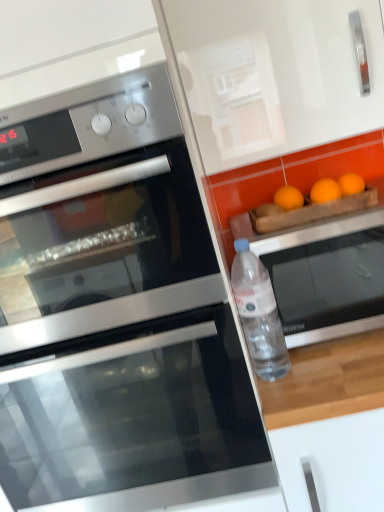
I want to click on transparent plastic bottle at right, so click(259, 314).

Identify the location of stainless steel oven at left, which appears as the 3th oven when viewed from the right. (107, 254).

From a real-world perspective, is stainless steel oven at right, the 3th oven positioned from the left, physically above transparent plastic bottle at right?

No, from a real-world perspective, stainless steel oven at right, the 3th oven positioned from the left, is not on top of transparent plastic bottle at right.

How different are the orientations of stainless steel oven at right, which is the first oven in right-to-left order, and transparent plastic bottle at right in degrees?

stainless steel oven at right, which is the first oven in right-to-left order, and transparent plastic bottle at right are facing 0.00254 degrees away from each other.

Which point is more forward, (370,312) or (274,297)?

The point (274,297) is closer to the camera.

Is stainless steel oven at right, which is the first oven in right-to-left order, spatially inside stainless steel oven at left, which ranks as the 1th oven in left-to-right order, or outside of it?

stainless steel oven at right, which is the first oven in right-to-left order, exists outside the volume of stainless steel oven at left, which ranks as the 1th oven in left-to-right order.

From a real-world perspective, is stainless steel oven at right, which is the first oven in right-to-left order, positioned under stainless steel oven at left, which ranks as the 1th oven in left-to-right order, based on gravity?

Indeed, from a real-world perspective, stainless steel oven at right, which is the first oven in right-to-left order, is positioned beneath stainless steel oven at left, which ranks as the 1th oven in left-to-right order.

Locate an element on the screen. The image size is (384, 512). oven located above the stainless steel oven at right, which is the first oven in right-to-left order (from a real-world perspective) is located at coordinates [107, 254].

Is stainless steel oven at right, the 3th oven positioned from the left, facing away from stainless steel oven at left, which ranks as the 1th oven in left-to-right order?

That's not correct — stainless steel oven at right, the 3th oven positioned from the left, is not looking away from stainless steel oven at left, which ranks as the 1th oven in left-to-right order.

Considering the sizes of objects stainless steel oven at right, which is the first oven in right-to-left order, and stainless steel oven at lower left, which ranks as the second oven in left-to-right order, in the image provided, who is thinner, stainless steel oven at right, which is the first oven in right-to-left order, or stainless steel oven at lower left, which ranks as the second oven in left-to-right order,?

stainless steel oven at right, which is the first oven in right-to-left order.

Is stainless steel oven at right, which is the first oven in right-to-left order, at the right side of stainless steel oven at lower left, which ranks as the second oven in left-to-right order?

Yes.

From the image's perspective, which oven is the 1st one above the stainless steel oven at lower left, which is counted as the second oven, starting from the right? Please provide its 2D coordinates.

[(327, 276)]

From a real-world perspective, is stainless steel oven at right, the 3th oven positioned from the left, located higher than stainless steel oven at lower left, which is counted as the second oven, starting from the right?

Indeed, from a real-world perspective, stainless steel oven at right, the 3th oven positioned from the left, stands above stainless steel oven at lower left, which is counted as the second oven, starting from the right.

From a real-world perspective, who is located higher, transparent plastic bottle at right or stainless steel oven at right, the 3th oven positioned from the left?

transparent plastic bottle at right, from a real-world perspective.

Considering the sizes of transparent plastic bottle at right and stainless steel oven at right, the 3th oven positioned from the left, in the image, is transparent plastic bottle at right taller or shorter than stainless steel oven at right, the 3th oven positioned from the left,?

Considering their sizes, transparent plastic bottle at right has more height than stainless steel oven at right, the 3th oven positioned from the left.

Is transparent plastic bottle at right to the left or to the right of stainless steel oven at right, the 3th oven positioned from the left, in the image?

Based on their positions, transparent plastic bottle at right is located to the left of stainless steel oven at right, the 3th oven positioned from the left.

Based on the photo, are transparent plastic bottle at right and stainless steel oven at right, which is the first oven in right-to-left order, beside each other?

They are not placed beside each other.

Is stainless steel oven at left, which appears as the 3th oven when viewed from the right, at the back of transparent plastic bottle at right?

No.

Which of these two, transparent plastic bottle at right or stainless steel oven at left, which ranks as the 1th oven in left-to-right order, is bigger?

stainless steel oven at left, which ranks as the 1th oven in left-to-right order.

From the image's perspective, is transparent plastic bottle at right positioned above or below stainless steel oven at left, which ranks as the 1th oven in left-to-right order?

Based on their image positions, transparent plastic bottle at right is located beneath stainless steel oven at left, which ranks as the 1th oven in left-to-right order.

Considering the points (285, 369) and (40, 296), which point is behind, point (285, 369) or point (40, 296)?

Point (285, 369)

Which object is wider, stainless steel oven at left, which appears as the 3th oven when viewed from the right, or transparent plastic bottle at right?

stainless steel oven at left, which appears as the 3th oven when viewed from the right.

Based on the photo, considering the sizes of stainless steel oven at left, which appears as the 3th oven when viewed from the right, and transparent plastic bottle at right in the image, is stainless steel oven at left, which appears as the 3th oven when viewed from the right, bigger or smaller than transparent plastic bottle at right?

Considering their sizes, stainless steel oven at left, which appears as the 3th oven when viewed from the right, takes up more space than transparent plastic bottle at right.

From the image's perspective, is stainless steel oven at left, which ranks as the 1th oven in left-to-right order, below transparent plastic bottle at right?

No.

Is stainless steel oven at left, which appears as the 3th oven when viewed from the right, far from transparent plastic bottle at right?

They are positioned close to each other.

Which of these two, stainless steel oven at lower left, which is counted as the second oven, starting from the right, or transparent plastic bottle at right, stands taller?

With more height is stainless steel oven at lower left, which is counted as the second oven, starting from the right.

In the image, is stainless steel oven at lower left, which ranks as the second oven in left-to-right order, on the left side or the right side of transparent plastic bottle at right?

stainless steel oven at lower left, which ranks as the second oven in left-to-right order, is positioned on transparent plastic bottle at right's left side.

Considering the relative sizes of stainless steel oven at lower left, which ranks as the second oven in left-to-right order, and transparent plastic bottle at right in the image provided, is stainless steel oven at lower left, which ranks as the second oven in left-to-right order, thinner than transparent plastic bottle at right?

Incorrect, the width of stainless steel oven at lower left, which ranks as the second oven in left-to-right order, is not less than that of transparent plastic bottle at right.

Is stainless steel oven at lower left, which ranks as the second oven in left-to-right order, located outside transparent plastic bottle at right?

Indeed, stainless steel oven at lower left, which ranks as the second oven in left-to-right order, is completely outside transparent plastic bottle at right.

Identify the location of bottle above the stainless steel oven at right, the 3th oven positioned from the left (from a real-world perspective). (259, 314).

The image size is (384, 512). What are the coordinates of `the 2nd oven to the right when counting from the stainless steel oven at left, which ranks as the 1th oven in left-to-right order` in the screenshot? It's located at pos(327,276).

Considering their positions, is stainless steel oven at lower left, which ranks as the second oven in left-to-right order, positioned closer to transparent plastic bottle at right than stainless steel oven at left, which ranks as the 1th oven in left-to-right order?

stainless steel oven at lower left, which ranks as the second oven in left-to-right order.

From the image, which object appears to be farther from stainless steel oven at left, which ranks as the 1th oven in left-to-right order, transparent plastic bottle at right or stainless steel oven at lower left, which is counted as the second oven, starting from the right?

transparent plastic bottle at right is further to stainless steel oven at left, which ranks as the 1th oven in left-to-right order.

Based on their spatial positions, is stainless steel oven at right, the 3th oven positioned from the left, or stainless steel oven at lower left, which is counted as the second oven, starting from the right, closer to stainless steel oven at left, which appears as the 3th oven when viewed from the right?

The object closer to stainless steel oven at left, which appears as the 3th oven when viewed from the right, is stainless steel oven at lower left, which is counted as the second oven, starting from the right.

Based on their spatial positions, is stainless steel oven at left, which ranks as the 1th oven in left-to-right order, or stainless steel oven at right, which is the first oven in right-to-left order, closer to transparent plastic bottle at right?

stainless steel oven at right, which is the first oven in right-to-left order, lies closer to transparent plastic bottle at right than the other object.

Based on their spatial positions, is stainless steel oven at lower left, which is counted as the second oven, starting from the right, or stainless steel oven at right, the 3th oven positioned from the left, closer to transparent plastic bottle at right?

stainless steel oven at right, the 3th oven positioned from the left.

Looking at the image, which one is located further to stainless steel oven at lower left, which ranks as the second oven in left-to-right order, stainless steel oven at right, which is the first oven in right-to-left order, or transparent plastic bottle at right?

stainless steel oven at right, which is the first oven in right-to-left order, is positioned further to the anchor stainless steel oven at lower left, which ranks as the second oven in left-to-right order.

Considering their positions, is stainless steel oven at lower left, which ranks as the second oven in left-to-right order, positioned further to stainless steel oven at right, which is the first oven in right-to-left order, than transparent plastic bottle at right?

The object further to stainless steel oven at right, which is the first oven in right-to-left order, is stainless steel oven at lower left, which ranks as the second oven in left-to-right order.

Estimate the real-world distances between objects in this image. Which object is further from stainless steel oven at right, the 3th oven positioned from the left, stainless steel oven at lower left, which ranks as the second oven in left-to-right order, or stainless steel oven at left, which appears as the 3th oven when viewed from the right?

stainless steel oven at lower left, which ranks as the second oven in left-to-right order, lies further to stainless steel oven at right, the 3th oven positioned from the left, than the other object.

Identify the location of bottle between stainless steel oven at lower left, which ranks as the second oven in left-to-right order, and stainless steel oven at right, the 3th oven positioned from the left, in the horizontal direction. 259,314.

This screenshot has width=384, height=512. Find the location of `oven located between stainless steel oven at left, which ranks as the 1th oven in left-to-right order, and stainless steel oven at right, which is the first oven in right-to-left order, in the left-right direction`. oven located between stainless steel oven at left, which ranks as the 1th oven in left-to-right order, and stainless steel oven at right, which is the first oven in right-to-left order, in the left-right direction is located at coordinates [x=134, y=420].

Locate an element on the screen. oven situated between stainless steel oven at left, which ranks as the 1th oven in left-to-right order, and transparent plastic bottle at right from left to right is located at coordinates (134, 420).

I want to click on bottle situated between stainless steel oven at left, which appears as the 3th oven when viewed from the right, and stainless steel oven at right, the 3th oven positioned from the left, from left to right, so click(259, 314).